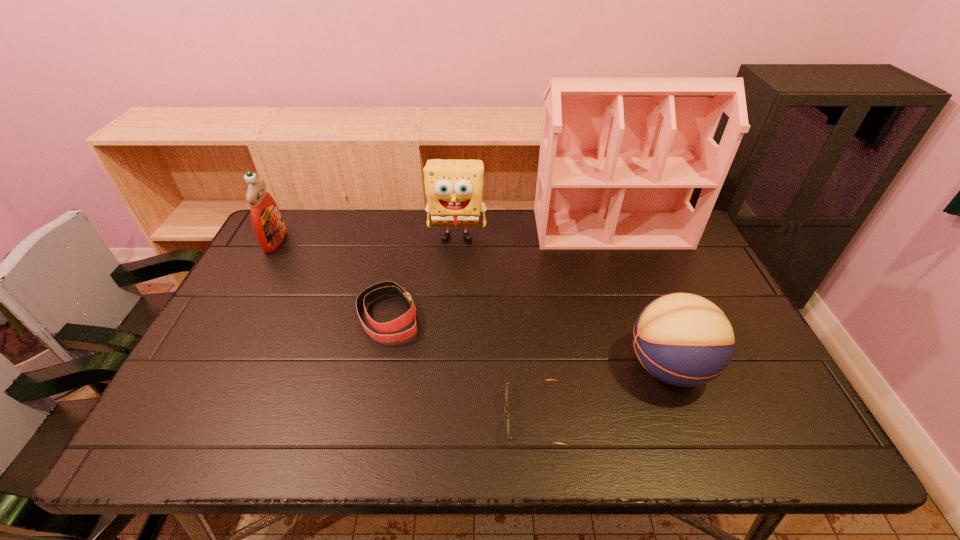
Locate which object ranks third in proximity to the dollhouse. Please provide its 2D coordinates. Your answer should be formatted as a tuple, i.e. [(x, y)], where the tuple contains the x and y coordinates of a point satisfying the conditions above.

[(384, 288)]

I want to click on object identified as the fourth closest to the sponge, so click(x=682, y=339).

Locate an element on the screen. The image size is (960, 540). free spot that satisfies the following two spatial constraints: 1. on the front surface of the detergent; 2. on the back side of the dog collar is located at coordinates (234, 315).

Find the location of a particular element. This screenshot has height=540, width=960. free space that satisfies the following two spatial constraints: 1. on the face of the sponge; 2. on the front surface of the detergent is located at coordinates (457, 241).

Find the location of a particular element. The height and width of the screenshot is (540, 960). vacant space that satisfies the following two spatial constraints: 1. on the front-facing side of the tallest object; 2. on the temples of the shortest object is located at coordinates (678, 417).